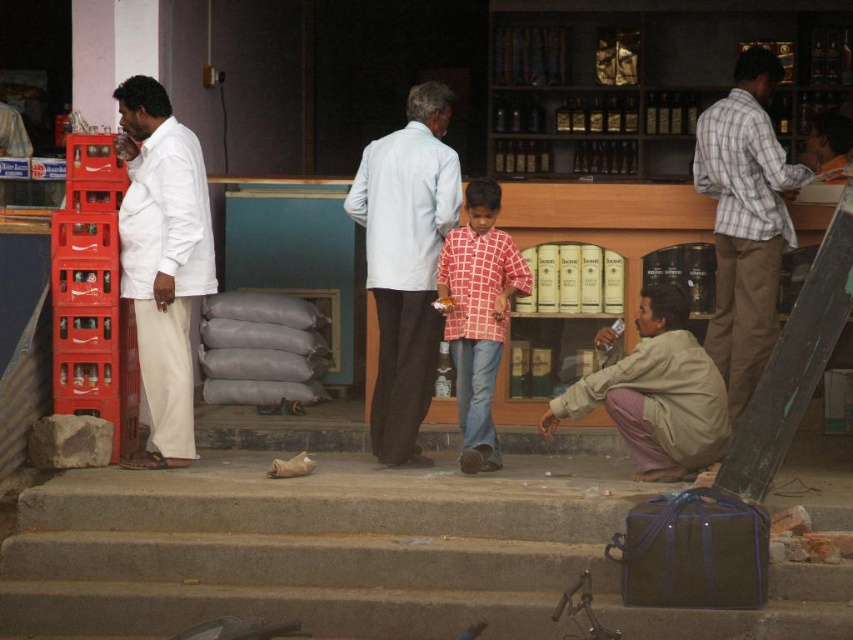
From the picture: You are a delivery person trying to place a package on the concrete stairs at lower center. The package is as tall as the white cotton shirt at left. Will the package fit on the stairs?

The concrete stairs at lower center is shorter than the white cotton shirt at left. Since the package is as tall as the white cotton shirt at left, it will not fit on the concrete stairs at lower center because the stairs are shorter than the package.

You are standing at the entrance of the shop and want to place a new bottle on the wooden counter. The shopkeeper tells you to place it at point (357, 556). However, you notice that this point is actually on the concrete stairs at lower center. Can you confirm if the shopkeeper made a mistake?

Yes, the shopkeeper made a mistake because point (357, 556) corresponds to the concrete stairs at lower center, not the wooden counter.

You are a delivery person trying to reach the beige cotton shirt at lower right to deliver a package. The concrete stairs at lower center might be in your way. Which direction should you move to avoid the stairs?

You should move to the right to avoid the concrete stairs at lower center since they are to the left of the beige cotton shirt at lower right.